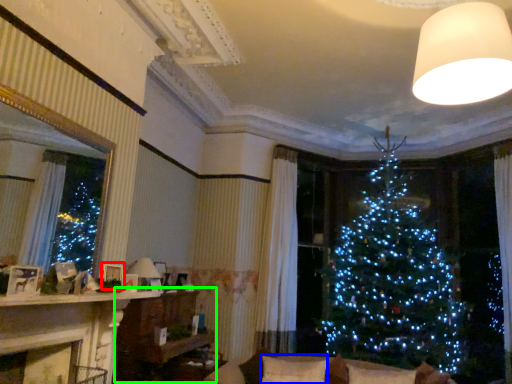
Question: Which object is the farthest from picture frame (highlighted by a red box)? Choose among these: pillow (highlighted by a blue box) or furniture (highlighted by a green box).

Choices:
 (A) pillow
 (B) furniture

Answer: (A)